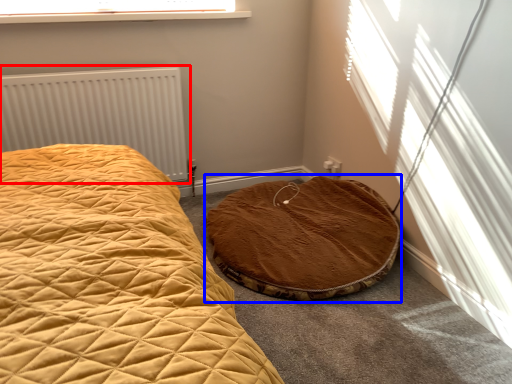
Question: Among these objects, which one is farthest to the camera, radiator (highlighted by a red box) or cat bed (highlighted by a blue box)?

Choices:
 (A) radiator
 (B) cat bed

Answer: (A)